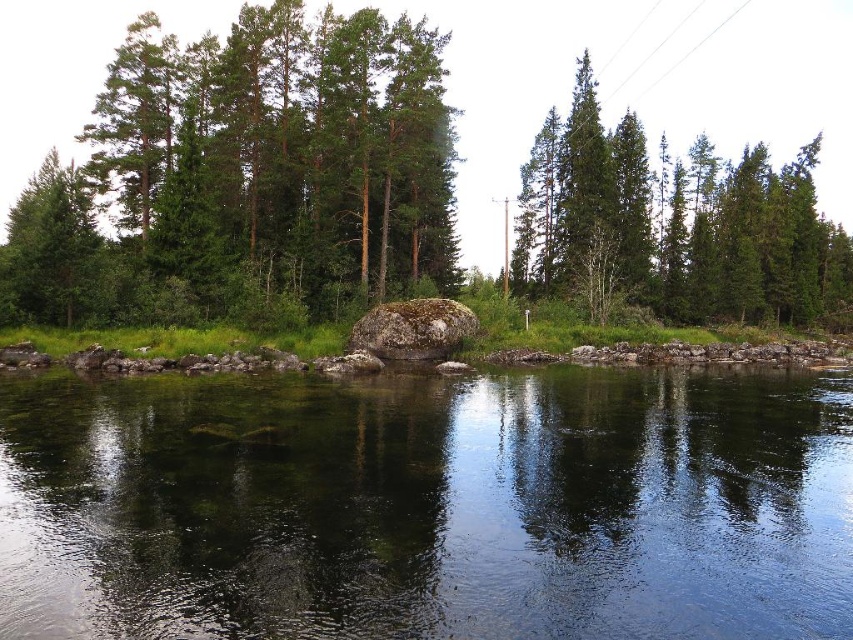
Question: Based on their relative distances, which object is nearer to the green mossy rock at center?

Choices:
 (A) green matte tree at center
 (B) clear water at center

Answer: (A)

Question: Which of the following is the farthest from the observer?

Choices:
 (A) green matte tree at left
 (B) green mossy rock at center
 (C) clear water at center

Answer: (B)

Question: Can you confirm if clear water at center is bigger than green matte tree at left?

Choices:
 (A) yes
 (B) no

Answer: (B)

Question: Does green matte tree at center have a smaller size compared to green matte tree at left?

Choices:
 (A) no
 (B) yes

Answer: (B)

Question: Is green mossy rock at center below green matte tree at center?

Choices:
 (A) yes
 (B) no

Answer: (B)

Question: Which point appears farthest from the camera in this image?

Choices:
 (A) (93, 288)
 (B) (497, 444)

Answer: (A)